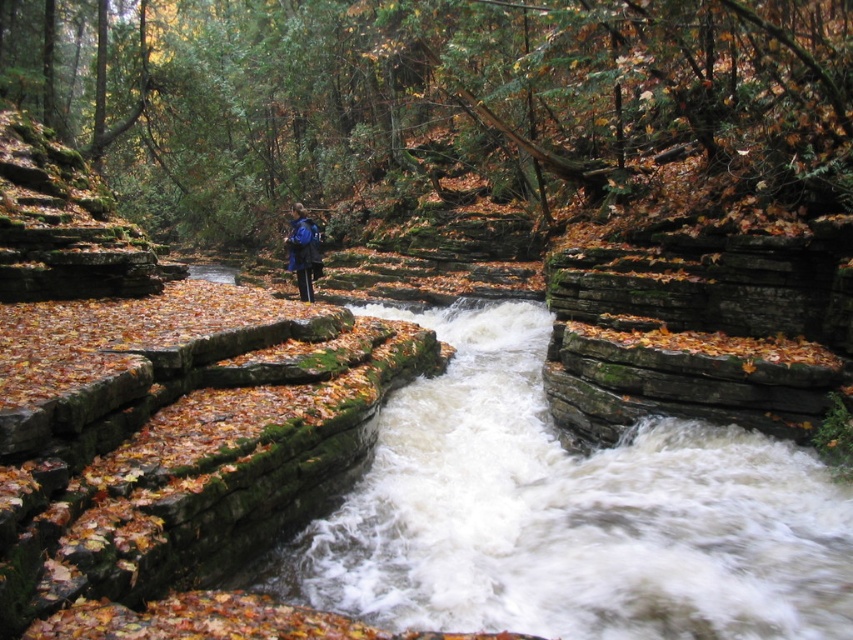
Is green mossy rocks at center bigger than blue fabric backpack at center?

Yes.

Is green mossy rocks at center further to the viewer compared to blue fabric backpack at center?

No, green mossy rocks at center is closer to the viewer.

Between point (303, 65) and point (294, 205), which one is positioned behind?

Positioned behind is point (294, 205).

Identify the location of green mossy rocks at center. The height and width of the screenshot is (640, 853). (430, 97).

Can you confirm if green mossy rocks at center is positioned to the left of brown stone stream at center?

Indeed, green mossy rocks at center is positioned on the left side of brown stone stream at center.

Who is positioned more to the right, green mossy rocks at center or brown stone stream at center?

From the viewer's perspective, brown stone stream at center appears more on the right side.

Is point (402, 104) positioned before point (450, 616)?

No, (402, 104) is further to viewer.

This screenshot has height=640, width=853. What are the coordinates of `green mossy rocks at center` in the screenshot? It's located at (430, 97).

Is brown stone stream at center to the right of blue fabric backpack at center from the viewer's perspective?

Indeed, brown stone stream at center is positioned on the right side of blue fabric backpack at center.

Is point (476, 593) positioned behind point (300, 292)?

No, (476, 593) is closer to viewer.

Where is `brown stone stream at center`? The width and height of the screenshot is (853, 640). brown stone stream at center is located at coordinates (569, 515).